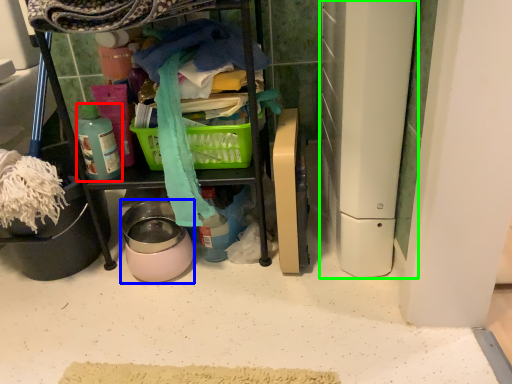
Question: Based on their relative distances, which object is farther from bottle (highlighted by a red box)? Choose from appliance (highlighted by a blue box) and appliance (highlighted by a green box).

Choices:
 (A) appliance
 (B) appliance

Answer: (B)